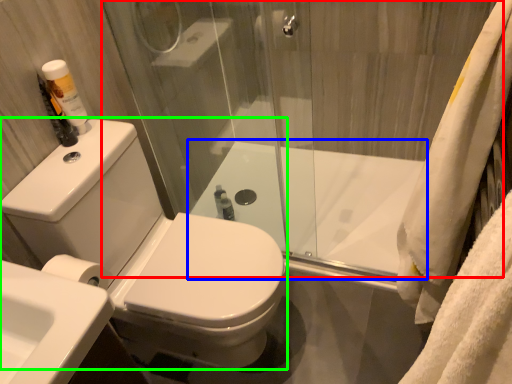
Question: Which object is positioned farthest from shower door (highlighted by a red box)? Select from bath (highlighted by a blue box) and porcelain (highlighted by a green box).

Choices:
 (A) bath
 (B) porcelain

Answer: (B)